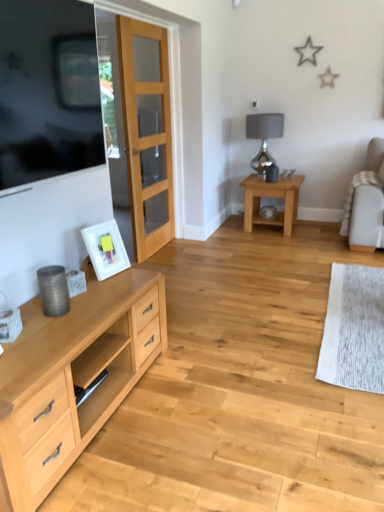
Where is `vacant area that lies between clear glass door at center and white fabric chair at right`? vacant area that lies between clear glass door at center and white fabric chair at right is located at coordinates (251, 248).